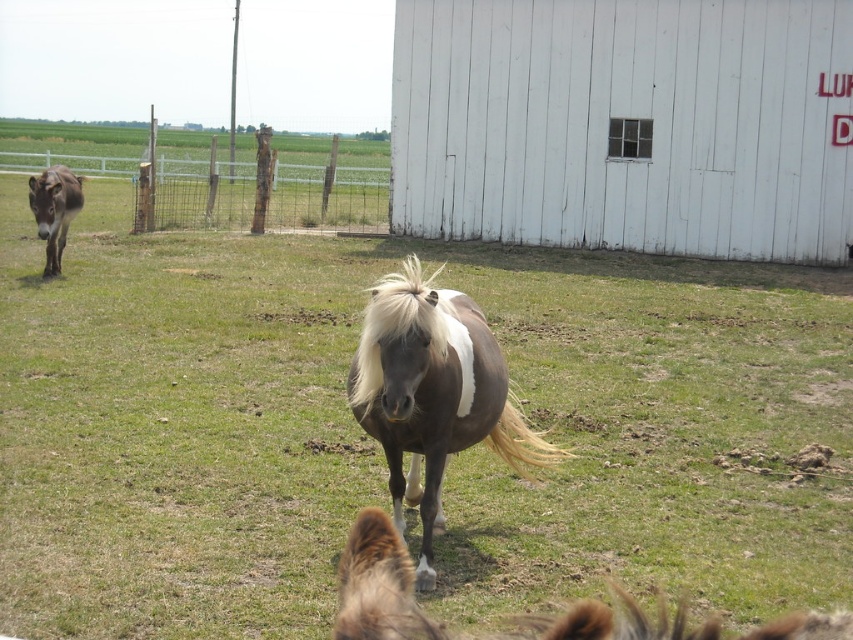
Based on the photo, you are a farmer who wants to lead the brown glossy horse at center to the white wooden barn at center. Based on their positions in the image, which direction should you guide the horse to move towards the barn?

The white wooden barn at center is positioned over the brown glossy horse at center, so the horse should move upwards to reach the barn.

You are standing in the middle of the farm field looking at the scene. Which direction should you move to get closer to the white wooden barn at center?

Move towards the center of the scene to get closer to the white wooden barn at center since it is located at point [625,124].

You are a farmer checking the space between the white wooden barn at center and the brown glossy horse at center. Can you fit a 3m wide tractor between them?

The white wooden barn at center has a lesser width compared to brown glossy horse at center, so the space between them may be sufficient to fit a 3m wide tractor, but the exact distance isn not provided in the description.